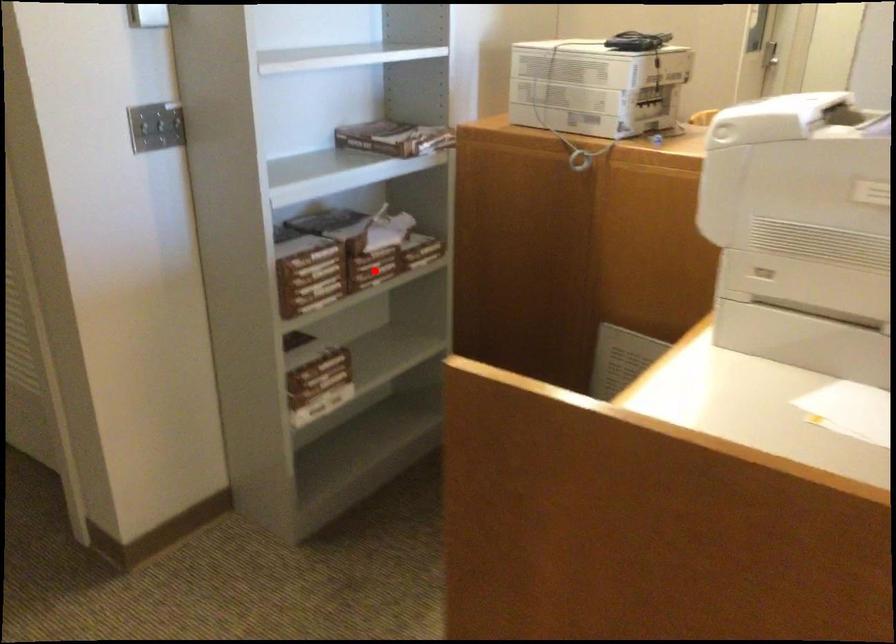
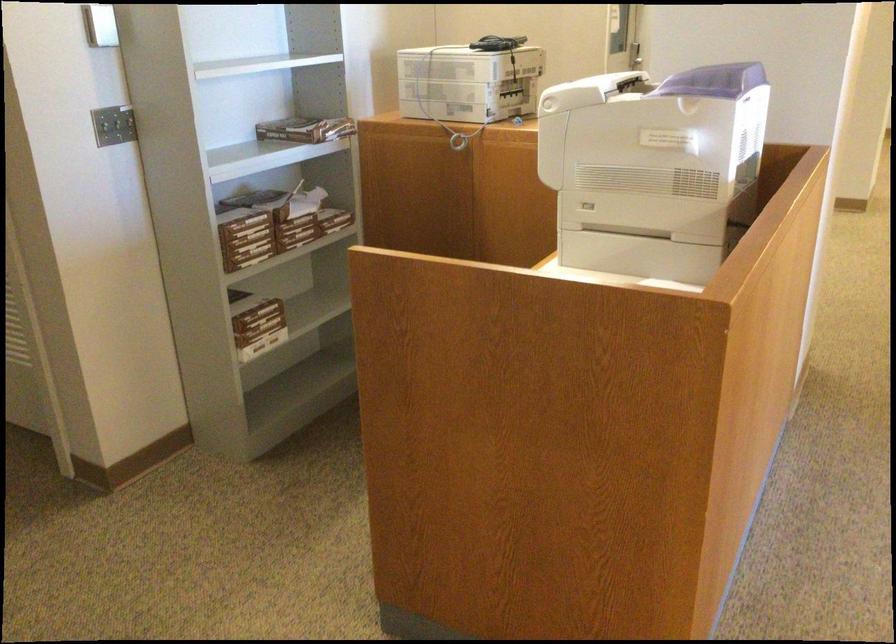
Question: I am providing you with two images of the same scene from different viewpoints. Given a red point in image1, look at the same physical point in image2. Is it:

Choices:
 (A) Closer to the viewpoint
 (B) Farther from the viewpoint

Answer: (B)